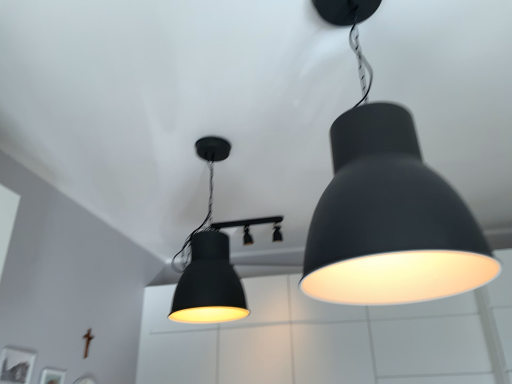
Question: Considering the positions of point (323, 1) and point (247, 223), is point (323, 1) closer or farther from the camera than point (247, 223)?

Choices:
 (A) farther
 (B) closer

Answer: (B)

Question: From a real-world perspective, relative to matte black light fixture at center, the third lamp in the front-to-back sequence, is matte black lampshade at upper right, the third lamp positioned from the back, vertically above or below?

Choices:
 (A) above
 (B) below

Answer: (B)

Question: Considering the real-world distances, which object is closest to the matte black light fixture at center, the third lamp in the front-to-back sequence?

Choices:
 (A) matte black lampshade at center, acting as the 2th lamp starting from the front
 (B) matte black lampshade at upper right, the third lamp positioned from the back

Answer: (A)

Question: Which of these objects is positioned closest to the matte black lampshade at upper right, the third lamp positioned from the back?

Choices:
 (A) matte black lampshade at center, acting as the 2th lamp starting from the front
 (B) matte black light fixture at center, marked as the 1th lamp in a back-to-front arrangement

Answer: (A)